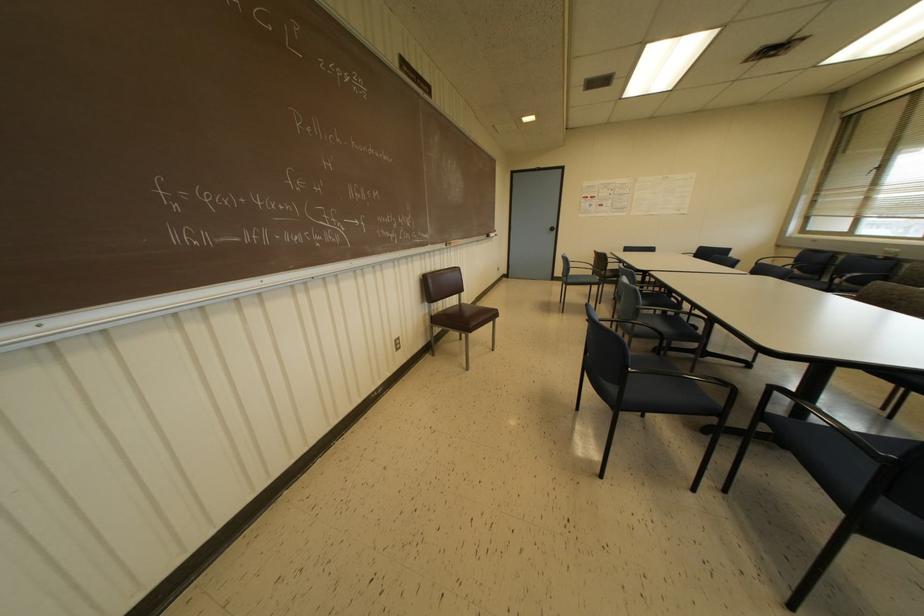
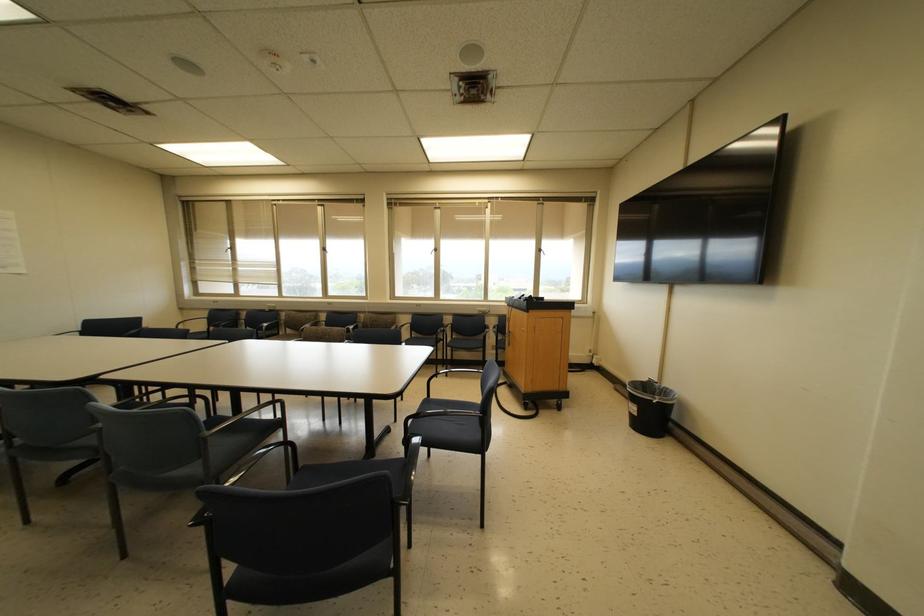
Question: The camera is either moving clockwise (left) or counter-clockwise (right) around the object. The first image is from the beginning of the video and the second image is from the end. Is the camera moving left or right when shooting the video?

Choices:
 (A) Left
 (B) Right

Answer: (A)